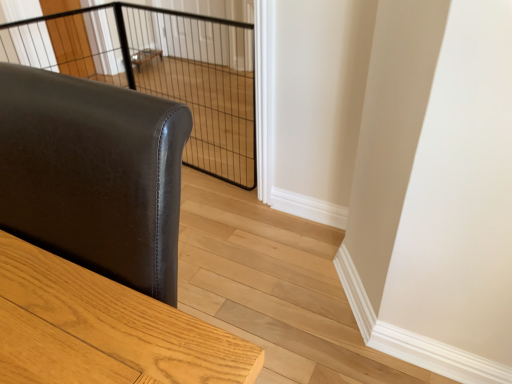
The height and width of the screenshot is (384, 512). What do you see at coordinates (159, 70) in the screenshot?
I see `black wire mesh cage at upper center` at bounding box center [159, 70].

This screenshot has height=384, width=512. I want to click on clear wire mesh at upper left, marked as the 2th screen door in a right-to-left arrangement, so pyautogui.click(x=71, y=45).

This screenshot has height=384, width=512. What are the coordinates of `black wire mesh cage at upper center` in the screenshot? It's located at (159, 70).

Which of these two, clear wire mesh at upper left, marked as the 2th screen door in a right-to-left arrangement, or clear glass screen door at upper center, which is the 1th screen door in right-to-left order, is bigger?

clear glass screen door at upper center, which is the 1th screen door in right-to-left order, is bigger.

Is point (56, 35) closer or farther from the camera than point (217, 1)?

Point (56, 35).

In the scene shown: Is clear wire mesh at upper left, marked as the 2th screen door in a right-to-left arrangement, wider than clear glass screen door at upper center, which is the 1th screen door in right-to-left order?

In fact, clear wire mesh at upper left, marked as the 2th screen door in a right-to-left arrangement, might be narrower than clear glass screen door at upper center, which is the 1th screen door in right-to-left order.

Does clear wire mesh at upper left, which ranks as the first screen door in left-to-right order, appear on the right side of clear glass screen door at upper center, marked as the 2th screen door in a left-to-right arrangement?

No.

Which of these two, black wire mesh cage at upper center or matte black leather sofa at left, is bigger?

matte black leather sofa at left is bigger.

This screenshot has height=384, width=512. In order to click on furniture that is above the black wire mesh cage at upper center (from a real-world perspective) in this screenshot , I will do `click(93, 175)`.

Is point (3, 48) closer or farther from the camera than point (168, 127)?

Point (3, 48).

Is matte black leather sofa at left at the back of black wire mesh cage at upper center?

No, black wire mesh cage at upper center's orientation is not away from matte black leather sofa at left.

Considering the sizes of objects clear wire mesh at upper left, which ranks as the first screen door in left-to-right order, and matte black leather sofa at left in the image provided, who is taller, clear wire mesh at upper left, which ranks as the first screen door in left-to-right order, or matte black leather sofa at left?

With more height is matte black leather sofa at left.

Can matte black leather sofa at left be found inside clear wire mesh at upper left, which ranks as the first screen door in left-to-right order?

Actually, matte black leather sofa at left is outside clear wire mesh at upper left, which ranks as the first screen door in left-to-right order.

From a real-world perspective, is clear wire mesh at upper left, which ranks as the first screen door in left-to-right order, above or below matte black leather sofa at left?

clear wire mesh at upper left, which ranks as the first screen door in left-to-right order, is below matte black leather sofa at left.

Is matte black leather sofa at left further to camera compared to clear wire mesh at upper left, which ranks as the first screen door in left-to-right order?

No.

Considering the sizes of matte black leather sofa at left and clear wire mesh at upper left, marked as the 2th screen door in a right-to-left arrangement, in the image, is matte black leather sofa at left bigger or smaller than clear wire mesh at upper left, marked as the 2th screen door in a right-to-left arrangement,?

matte black leather sofa at left is bigger than clear wire mesh at upper left, marked as the 2th screen door in a right-to-left arrangement.

Measure the distance from matte black leather sofa at left to clear wire mesh at upper left, which ranks as the first screen door in left-to-right order.

matte black leather sofa at left and clear wire mesh at upper left, which ranks as the first screen door in left-to-right order, are 2.69 meters apart.

Can we say matte black leather sofa at left lies outside clear wire mesh at upper left, which ranks as the first screen door in left-to-right order?

Absolutely, matte black leather sofa at left is external to clear wire mesh at upper left, which ranks as the first screen door in left-to-right order.

Is clear glass screen door at upper center, marked as the 2th screen door in a left-to-right arrangement, not within matte black leather sofa at left?

Yes, clear glass screen door at upper center, marked as the 2th screen door in a left-to-right arrangement, is not within matte black leather sofa at left.

From a real-world perspective, which is physically above, clear glass screen door at upper center, marked as the 2th screen door in a left-to-right arrangement, or matte black leather sofa at left?

matte black leather sofa at left.

Consider the image. Is clear glass screen door at upper center, which is the 1th screen door in right-to-left order, in front of or behind matte black leather sofa at left in the image?

clear glass screen door at upper center, which is the 1th screen door in right-to-left order, is positioned farther from the viewer than matte black leather sofa at left.

Is clear glass screen door at upper center, marked as the 2th screen door in a left-to-right arrangement, far from black wire mesh cage at upper center?

No, clear glass screen door at upper center, marked as the 2th screen door in a left-to-right arrangement, is in close proximity to black wire mesh cage at upper center.

Is clear glass screen door at upper center, which is the 1th screen door in right-to-left order, positioned in front of black wire mesh cage at upper center?

No.

Is clear glass screen door at upper center, which is the 1th screen door in right-to-left order, facing away from black wire mesh cage at upper center?

That's not correct — clear glass screen door at upper center, which is the 1th screen door in right-to-left order, is not looking away from black wire mesh cage at upper center.

Visually, is matte black leather sofa at left positioned to the left or to the right of clear glass screen door at upper center, marked as the 2th screen door in a left-to-right arrangement?

In the image, matte black leather sofa at left appears on the right side of clear glass screen door at upper center, marked as the 2th screen door in a left-to-right arrangement.

In the scene shown: From the image's perspective, which one is positioned lower, matte black leather sofa at left or clear glass screen door at upper center, which is the 1th screen door in right-to-left order?

matte black leather sofa at left is shown below in the image.

Is matte black leather sofa at left spatially inside clear glass screen door at upper center, which is the 1th screen door in right-to-left order, or outside of it?

matte black leather sofa at left cannot be found inside clear glass screen door at upper center, which is the 1th screen door in right-to-left order.

Is matte black leather sofa at left wider or thinner than clear glass screen door at upper center, marked as the 2th screen door in a left-to-right arrangement?

matte black leather sofa at left is wider than clear glass screen door at upper center, marked as the 2th screen door in a left-to-right arrangement.

You are a GUI agent. You are given a task and a screenshot of the screen. Output one action in this format:
    pyautogui.click(x=<x>, y=<y>)
    Task: Click on the screen door below the clear wire mesh at upper left, marked as the 2th screen door in a right-to-left arrangement (from a real-world perspective)
    
    Given the screenshot: What is the action you would take?
    pyautogui.click(x=200, y=41)

Find the location of a particular element. This screenshot has height=384, width=512. cage on the right of matte black leather sofa at left is located at coordinates click(159, 70).

Based on their spatial positions, is clear glass screen door at upper center, which is the 1th screen door in right-to-left order, or clear wire mesh at upper left, marked as the 2th screen door in a right-to-left arrangement, further from matte black leather sofa at left?

clear glass screen door at upper center, which is the 1th screen door in right-to-left order, is positioned further to the anchor matte black leather sofa at left.

Looking at this image, which object lies further to the anchor point clear glass screen door at upper center, which is the 1th screen door in right-to-left order, clear wire mesh at upper left, marked as the 2th screen door in a right-to-left arrangement, or black wire mesh cage at upper center?

clear wire mesh at upper left, marked as the 2th screen door in a right-to-left arrangement, lies further to clear glass screen door at upper center, which is the 1th screen door in right-to-left order, than the other object.

Which object lies further to the anchor point clear glass screen door at upper center, marked as the 2th screen door in a left-to-right arrangement, black wire mesh cage at upper center or clear wire mesh at upper left, which ranks as the first screen door in left-to-right order?

clear wire mesh at upper left, which ranks as the first screen door in left-to-right order, lies further to clear glass screen door at upper center, marked as the 2th screen door in a left-to-right arrangement, than the other object.

Considering their positions, is clear glass screen door at upper center, which is the 1th screen door in right-to-left order, positioned closer to matte black leather sofa at left than black wire mesh cage at upper center?

The object closer to matte black leather sofa at left is black wire mesh cage at upper center.

Estimate the real-world distances between objects in this image. Which object is closer to clear wire mesh at upper left, which ranks as the first screen door in left-to-right order, black wire mesh cage at upper center or clear glass screen door at upper center, marked as the 2th screen door in a left-to-right arrangement?

black wire mesh cage at upper center.

Estimate the real-world distances between objects in this image. Which object is further from black wire mesh cage at upper center, clear glass screen door at upper center, marked as the 2th screen door in a left-to-right arrangement, or clear wire mesh at upper left, which ranks as the first screen door in left-to-right order?

clear wire mesh at upper left, which ranks as the first screen door in left-to-right order, is positioned further to the anchor black wire mesh cage at upper center.

In the scene shown: From the image, which object appears to be farther from black wire mesh cage at upper center, matte black leather sofa at left or clear wire mesh at upper left, marked as the 2th screen door in a right-to-left arrangement?

Among the two, matte black leather sofa at left is located further to black wire mesh cage at upper center.

Looking at the image, which one is located further to matte black leather sofa at left, clear wire mesh at upper left, which ranks as the first screen door in left-to-right order, or clear glass screen door at upper center, marked as the 2th screen door in a left-to-right arrangement?

Among the two, clear glass screen door at upper center, marked as the 2th screen door in a left-to-right arrangement, is located further to matte black leather sofa at left.

The height and width of the screenshot is (384, 512). What are the coordinates of `cage between matte black leather sofa at left and clear glass screen door at upper center, marked as the 2th screen door in a left-to-right arrangement, along the z-axis` in the screenshot? It's located at (159, 70).

The width and height of the screenshot is (512, 384). Find the location of `screen door between matte black leather sofa at left and clear glass screen door at upper center, which is the 1th screen door in right-to-left order, along the z-axis`. screen door between matte black leather sofa at left and clear glass screen door at upper center, which is the 1th screen door in right-to-left order, along the z-axis is located at coordinates (71, 45).

Where is `cage positioned between matte black leather sofa at left and clear wire mesh at upper left, which ranks as the first screen door in left-to-right order, from near to far`? The image size is (512, 384). cage positioned between matte black leather sofa at left and clear wire mesh at upper left, which ranks as the first screen door in left-to-right order, from near to far is located at coordinates tap(159, 70).

The height and width of the screenshot is (384, 512). What are the coordinates of `screen door between black wire mesh cage at upper center and clear glass screen door at upper center, marked as the 2th screen door in a left-to-right arrangement, from front to back` in the screenshot? It's located at (71, 45).